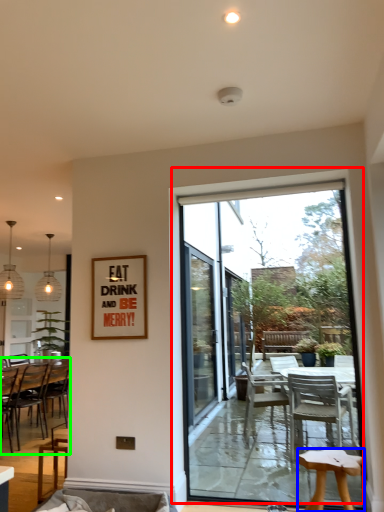
Question: Which object is positioned closest to window (highlighted by a red box)? Select from stool (highlighted by a blue box) and chair (highlighted by a green box).

Choices:
 (A) stool
 (B) chair

Answer: (A)